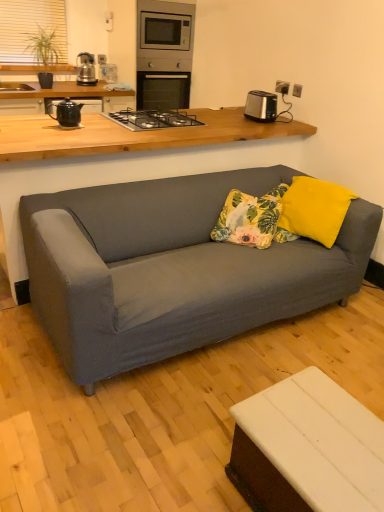
Question: Is beige fabric window screen at upper left a part of matte gray couch at center, marked as the first table in a back-to-front arrangement?

Choices:
 (A) no
 (B) yes

Answer: (A)

Question: Is matte gray couch at center, which is the second table in front-to-back order, outside beige fabric window screen at upper left?

Choices:
 (A) no
 (B) yes

Answer: (B)

Question: From a real-world perspective, is matte gray couch at center, marked as the first table in a back-to-front arrangement, under beige fabric window screen at upper left?

Choices:
 (A) yes
 (B) no

Answer: (A)

Question: Considering the relative sizes of matte gray couch at center, which appears as the second table when ordered from the bottom, and beige fabric window screen at upper left in the image provided, is matte gray couch at center, which appears as the second table when ordered from the bottom, shorter than beige fabric window screen at upper left?

Choices:
 (A) no
 (B) yes

Answer: (A)

Question: Does matte gray couch at center, which appears as the second table when ordered from the bottom, touch beige fabric window screen at upper left?

Choices:
 (A) yes
 (B) no

Answer: (B)

Question: Would you say satin silver toaster at upper right is to the left or to the right of beige fabric window screen at upper left in the picture?

Choices:
 (A) left
 (B) right

Answer: (B)

Question: Is satin silver toaster at upper right inside the boundaries of beige fabric window screen at upper left, or outside?

Choices:
 (A) outside
 (B) inside

Answer: (A)

Question: From a real-world perspective, is satin silver toaster at upper right physically located above or below beige fabric window screen at upper left?

Choices:
 (A) above
 (B) below

Answer: (B)

Question: In terms of height, does satin silver toaster at upper right look taller or shorter compared to beige fabric window screen at upper left?

Choices:
 (A) short
 (B) tall

Answer: (A)

Question: From a real-world perspective, relative to beige fabric window screen at upper left, is stainless steel oven at upper center vertically above or below?

Choices:
 (A) above
 (B) below

Answer: (B)

Question: From their relative heights in the image, would you say stainless steel oven at upper center is taller or shorter than beige fabric window screen at upper left?

Choices:
 (A) tall
 (B) short

Answer: (A)

Question: Does point (155, 27) appear closer or farther from the camera than point (3, 50)?

Choices:
 (A) closer
 (B) farther

Answer: (B)

Question: In terms of width, does stainless steel oven at upper center look wider or thinner when compared to beige fabric window screen at upper left?

Choices:
 (A) wide
 (B) thin

Answer: (A)

Question: Is floral fabric pillow at center in front of or behind black metal gas stove at upper center in the image?

Choices:
 (A) front
 (B) behind

Answer: (A)

Question: Does point pyautogui.click(x=274, y=232) appear closer or farther from the camera than point pyautogui.click(x=178, y=120)?

Choices:
 (A) closer
 (B) farther

Answer: (A)